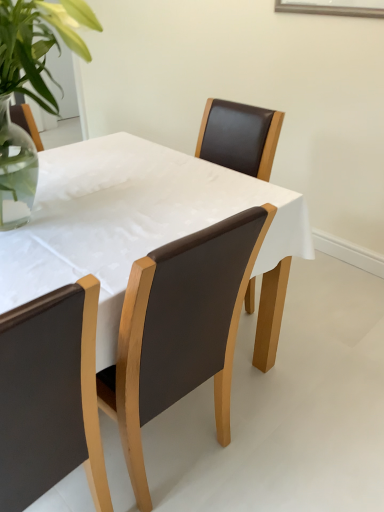
Where is `free space between matte brown table at center and brown leather chair at center, the 2th chair in the left-to-right sequence`? Image resolution: width=384 pixels, height=512 pixels. free space between matte brown table at center and brown leather chair at center, the 2th chair in the left-to-right sequence is located at coordinates (269, 410).